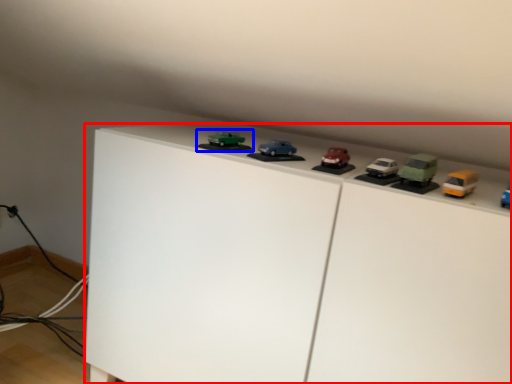
Question: Which object appears farthest to the camera in this image, furniture (highlighted by a red box) or toy (highlighted by a blue box)?

Choices:
 (A) furniture
 (B) toy

Answer: (B)